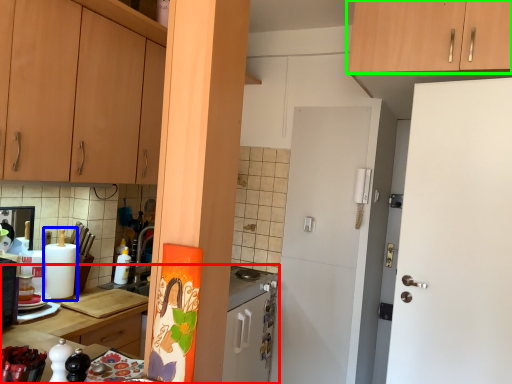
Question: Which is nearer to the countertop (highlighted by a red box)? appliance (highlighted by a blue box) or cabinetry (highlighted by a green box).

Choices:
 (A) appliance
 (B) cabinetry

Answer: (A)